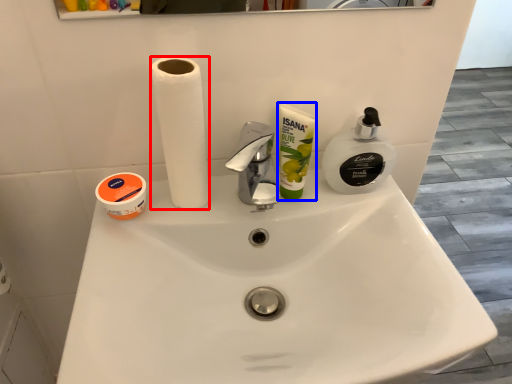
Question: Which of the following is the closest to the observer, paper towel (highlighted by a red box) or product (highlighted by a blue box)?

Choices:
 (A) paper towel
 (B) product

Answer: (A)